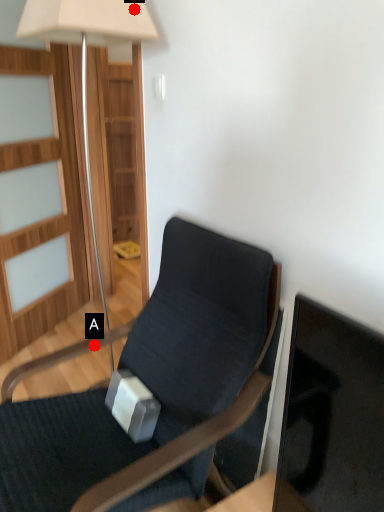
Question: Two points are circled on the image, labeled by A and B beside each circle. Which point appears closest to the camera in this image?

Choices:
 (A) A is closer
 (B) B is closer

Answer: (B)